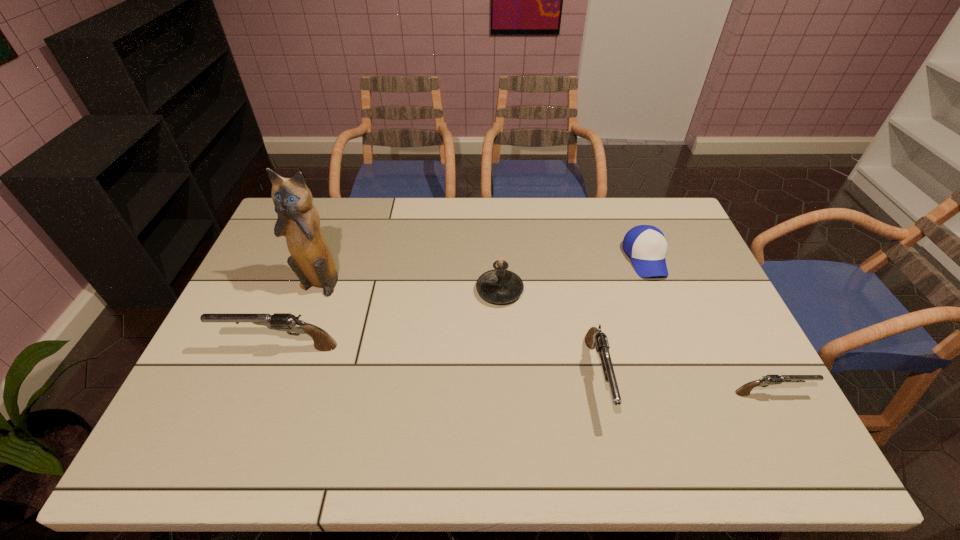
At what (x,y) coordinates should I click in order to perform the action: click on free point located 0.180m on the front-facing side of the baseball cap. Please return your answer as a coordinate pair (x, y). Image resolution: width=960 pixels, height=540 pixels. Looking at the image, I should click on (672, 327).

Where is `vacant space located on the front of the candle`? vacant space located on the front of the candle is located at coordinates (503, 360).

This screenshot has width=960, height=540. What are the coordinates of `object that is at the far edge` in the screenshot? It's located at [646, 245].

You are a GUI agent. You are given a task and a screenshot of the screen. Output one action in this format:
    pyautogui.click(x=<x>, y=<y>)
    Task: Click on the gun present at the left edge
    Image resolution: width=960 pixels, height=540 pixels.
    Given the screenshot: What is the action you would take?
    [x=288, y=322]

Where is `cat positioned at the left edge`? The height and width of the screenshot is (540, 960). cat positioned at the left edge is located at coordinates (311, 260).

The height and width of the screenshot is (540, 960). In order to click on gun at the right edge in this screenshot , I will do `click(744, 390)`.

Where is `baseball cap located at the right edge`? The height and width of the screenshot is (540, 960). baseball cap located at the right edge is located at coordinates (646, 245).

Where is `object at the far right corner`? The width and height of the screenshot is (960, 540). object at the far right corner is located at coordinates [x=646, y=245].

Locate an element on the screen. The height and width of the screenshot is (540, 960). object that is at the near right corner is located at coordinates coord(744,390).

You are a GUI agent. You are given a task and a screenshot of the screen. Output one action in this format:
    pyautogui.click(x=<x>, y=<y>)
    Task: Click on the vacant space at the far edge of the desktop
    This screenshot has height=540, width=960.
    Given the screenshot: What is the action you would take?
    pyautogui.click(x=540, y=205)